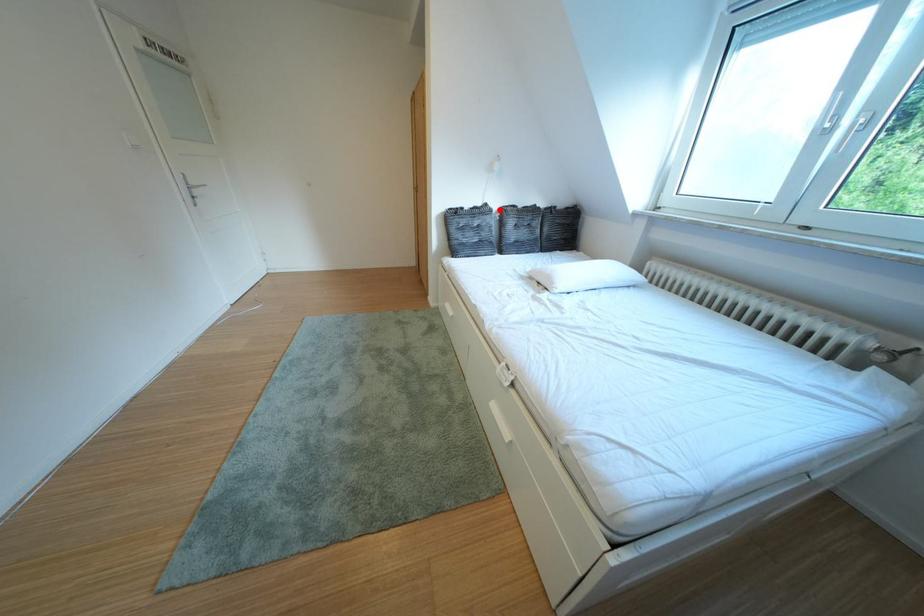
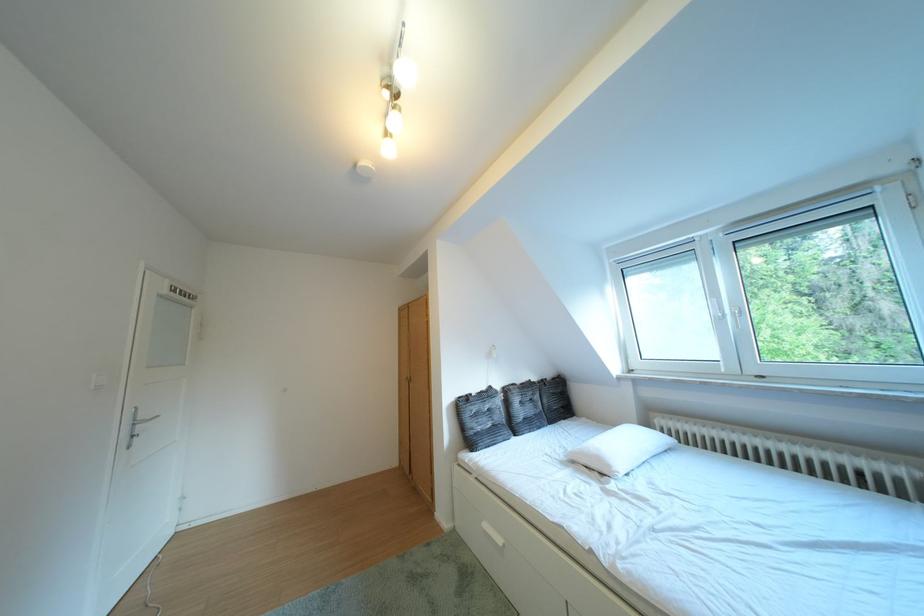
Question: I am providing you with two images of the same scene from different viewpoints. Given a red point in image1, look at the same physical point in image2. Is it:

Choices:
 (A) Closer to the viewpoint
 (B) Farther from the viewpoint

Answer: (B)